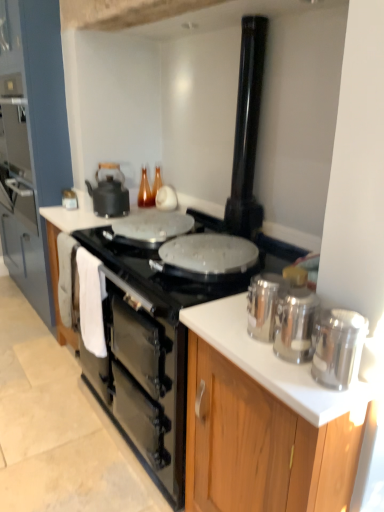
The height and width of the screenshot is (512, 384). Find the location of `vacant space to the left of polished stainless steel canisters at right, the 4th kitchen appliance from the left`. vacant space to the left of polished stainless steel canisters at right, the 4th kitchen appliance from the left is located at coordinates (274, 372).